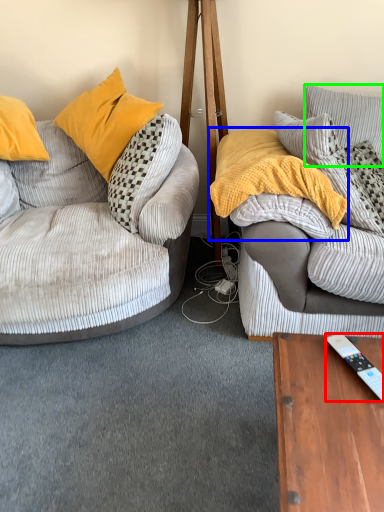
Question: Estimate the real-world distances between objects in this image. Which object is closer to remote control (highlighted by a red box), material (highlighted by a blue box) or pillow (highlighted by a green box)?

Choices:
 (A) material
 (B) pillow

Answer: (A)